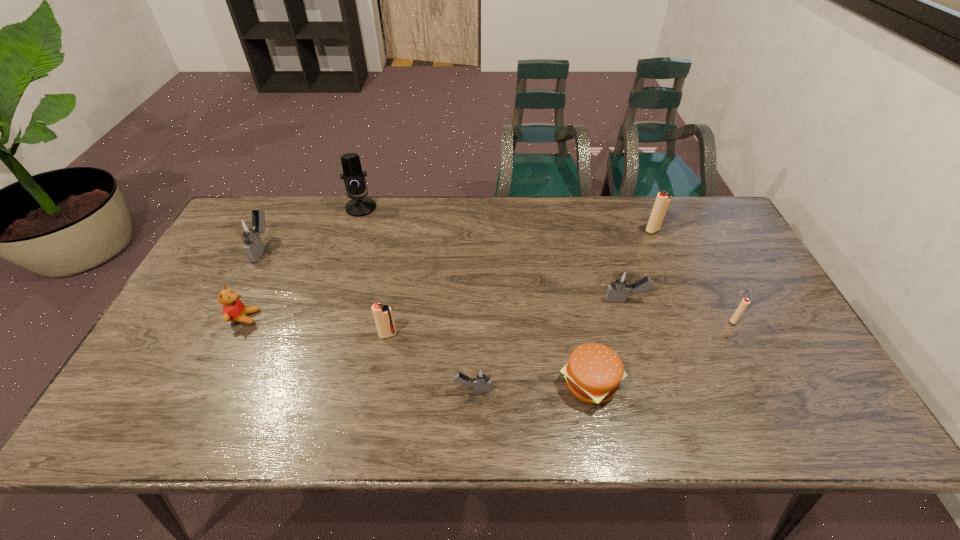
Where is `vacant space located on the front of the fifth farthest igniter`? The image size is (960, 540). vacant space located on the front of the fifth farthest igniter is located at coordinates (381, 370).

Where is `vacant area located 0.160m on the front-facing side of the red teddy bear`? vacant area located 0.160m on the front-facing side of the red teddy bear is located at coordinates (318, 318).

Identify the location of free point located on the left of the second farthest red igniter. (710, 320).

The image size is (960, 540). Find the location of `free space located 0.200m on the left of the nearest gray igniter`. free space located 0.200m on the left of the nearest gray igniter is located at coordinates (369, 389).

You are a GUI agent. You are given a task and a screenshot of the screen. Output one action in this format:
    pyautogui.click(x=<x>, y=<y>)
    Task: Click on the vacant space located 0.100m on the right of the hamburger
    
    Given the screenshot: What is the action you would take?
    pyautogui.click(x=665, y=383)

Locate an element on the screen. microphone situated at the far edge is located at coordinates (353, 177).

You are a GUI agent. You are given a task and a screenshot of the screen. Output one action in this format:
    pyautogui.click(x=<x>, y=<y>)
    Task: Click on the object that is at the near edge
    The image size is (960, 540).
    Given the screenshot: What is the action you would take?
    pyautogui.click(x=593, y=374)

The height and width of the screenshot is (540, 960). I want to click on igniter at the left edge, so click(x=249, y=229).

The height and width of the screenshot is (540, 960). I want to click on teddy bear located at the left edge, so pyautogui.click(x=234, y=310).

Where is `object that is at the right edge`? The height and width of the screenshot is (540, 960). object that is at the right edge is located at coordinates (743, 305).